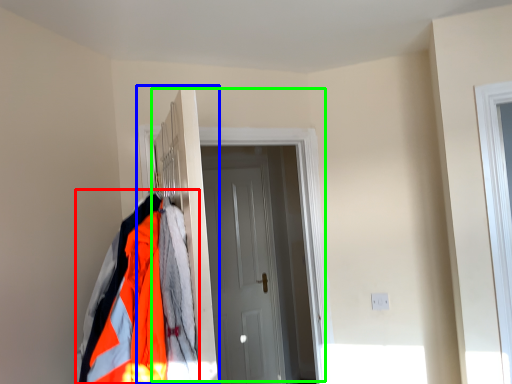
Question: Considering the real-world distances, which object is farthest from jacket (highlighted by a red box)? closet (highlighted by a blue box) or door (highlighted by a green box)?

Choices:
 (A) closet
 (B) door

Answer: (B)